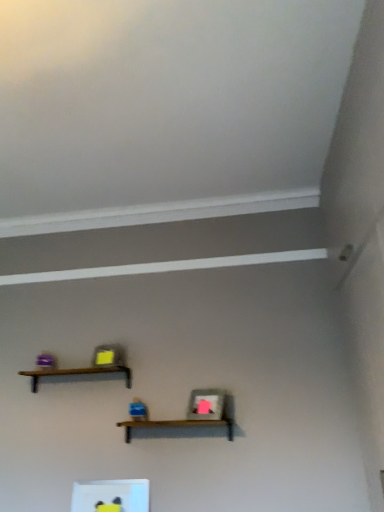
Question: Is brown wooden shelf at center, which appears as the 2th shelf when viewed from the top, in front of or behind brown wooden shelf at upper center, the third shelf in the bottom-to-top sequence, in the image?

Choices:
 (A) front
 (B) behind

Answer: (A)

Question: From the image's perspective, is brown wooden shelf at center, which appears as the 2th shelf when viewed from the top, above or below brown wooden shelf at upper center, which is the 1th shelf in top-to-bottom order?

Choices:
 (A) below
 (B) above

Answer: (A)

Question: Estimate the real-world distances between objects in this image. Which object is farther from the brown wooden shelf at center, which appears as the 2th shelf when viewed from the top?

Choices:
 (A) brown wooden shelf at upper center, which is the 1th shelf in top-to-bottom order
 (B) white glossy frame at lower center, which ranks as the third shelf in top-to-bottom order

Answer: (A)

Question: Which object is the farthest from the brown wooden shelf at upper center, which is the 1th shelf in top-to-bottom order?

Choices:
 (A) white glossy frame at lower center, which ranks as the third shelf in top-to-bottom order
 (B) brown wooden shelf at center, the 2th shelf in the bottom-to-top sequence

Answer: (A)